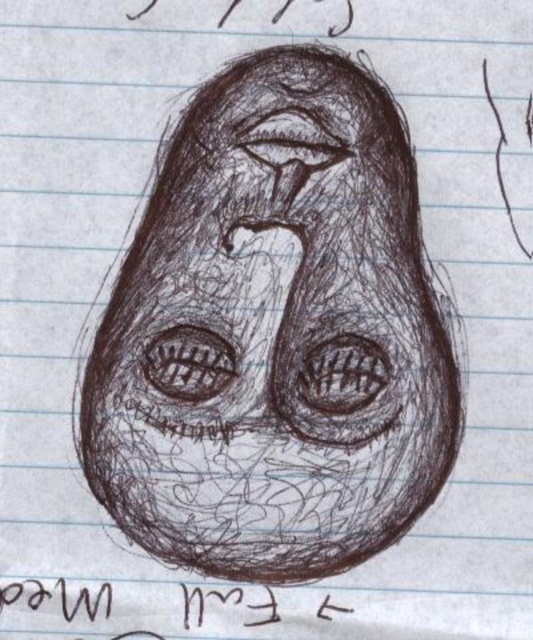
Question: Can you confirm if charcoal sketch face at center is positioned above brown ink text at bottom?

Choices:
 (A) yes
 (B) no

Answer: (A)

Question: Which point is closer to the camera?

Choices:
 (A) charcoal sketch face at center
 (B) brown ink text at bottom

Answer: (B)

Question: Does charcoal sketch face at center appear under brown ink text at bottom?

Choices:
 (A) yes
 (B) no

Answer: (B)

Question: Among these objects, which one is nearest to the camera?

Choices:
 (A) brown ink text at bottom
 (B) charcoal sketch face at center

Answer: (A)

Question: Is charcoal sketch face at center closer to camera compared to brown ink text at bottom?

Choices:
 (A) yes
 (B) no

Answer: (B)

Question: Which of the following is the farthest from the observer?

Choices:
 (A) brown ink text at bottom
 (B) charcoal sketch face at center

Answer: (B)